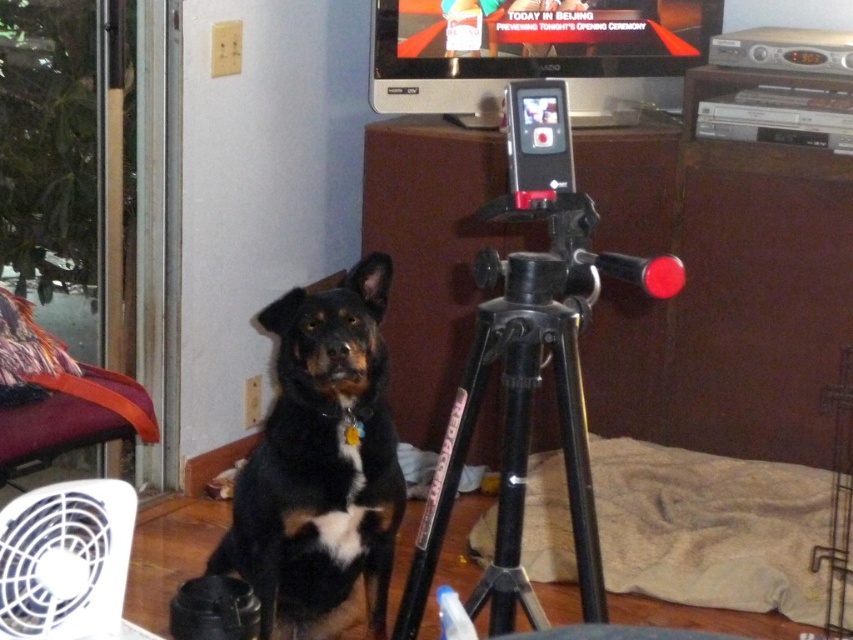
Question: Which object appears closest to the camera in this image?

Choices:
 (A) black matte tripod at center
 (B) black fur dog at center
 (C) white plastic fan at lower left

Answer: (C)

Question: Among these objects, which one is nearest to the camera?

Choices:
 (A) black matte tripod at center
 (B) white plastic fan at lower left

Answer: (B)

Question: Based on their relative distances, which object is farther from the black fur dog at center?

Choices:
 (A) black matte tripod at center
 (B) white plastic fan at lower left

Answer: (B)

Question: Is black matte tripod at center to the right of white plastic fan at lower left from the viewer's perspective?

Choices:
 (A) yes
 (B) no

Answer: (A)

Question: Is black matte tripod at center to the left of white plastic fan at lower left from the viewer's perspective?

Choices:
 (A) yes
 (B) no

Answer: (B)

Question: Is black matte tripod at center to the left of white plastic fan at lower left from the viewer's perspective?

Choices:
 (A) yes
 (B) no

Answer: (B)